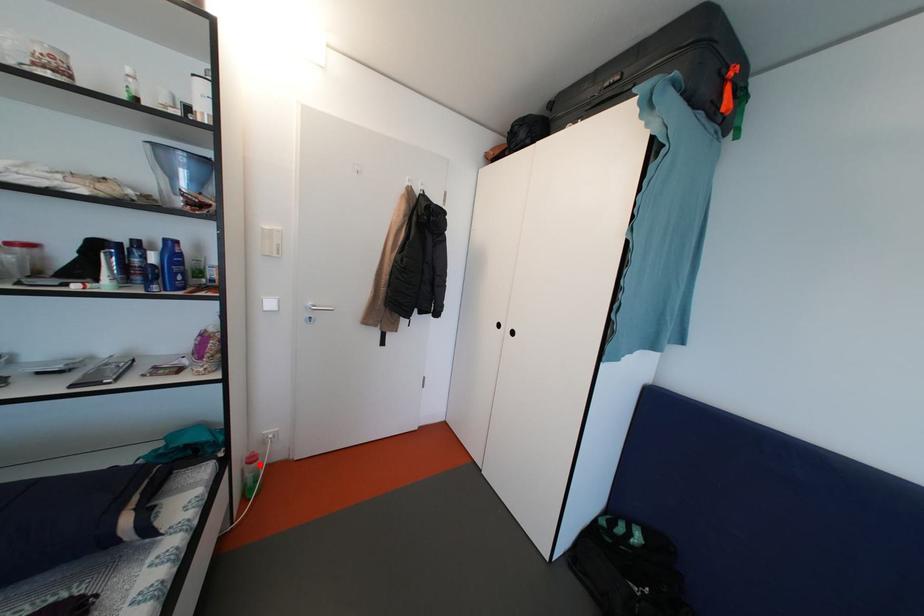
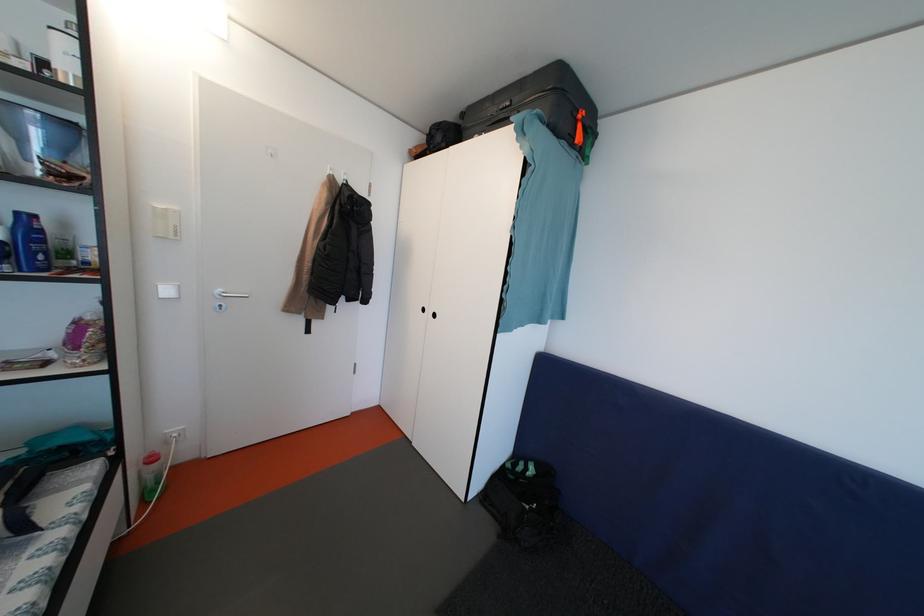
Question: I am providing you with two images of the same scene from different viewpoints. Image1 has a red point marked. In image2, the corresponding 3D location appears at what relative position? Reply with the corresponding letter.

Choices:
 (A) Closer
 (B) Farther

Answer: (B)